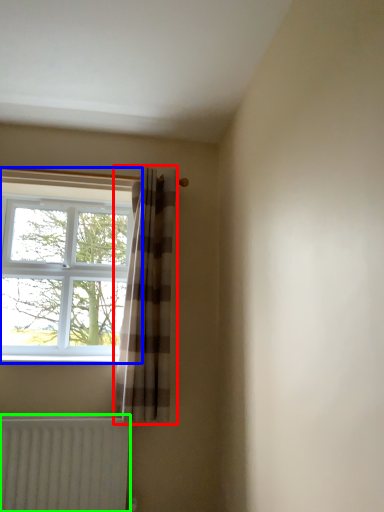
Question: Which object is positioned farthest from curtain (highlighted by a red box)? Select from window (highlighted by a blue box) and radiator (highlighted by a green box).

Choices:
 (A) window
 (B) radiator

Answer: (A)